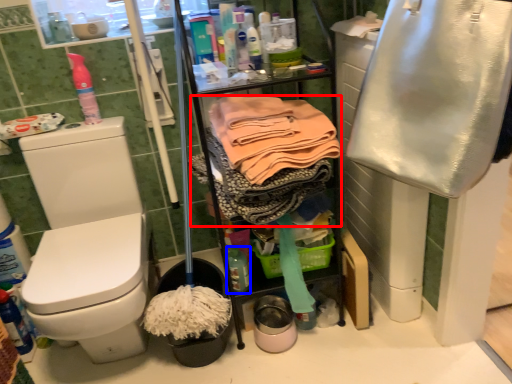
Question: Which point is closer to the camera, clothing (highlighted by a red box) or bottle (highlighted by a blue box)?

Choices:
 (A) clothing
 (B) bottle

Answer: (A)